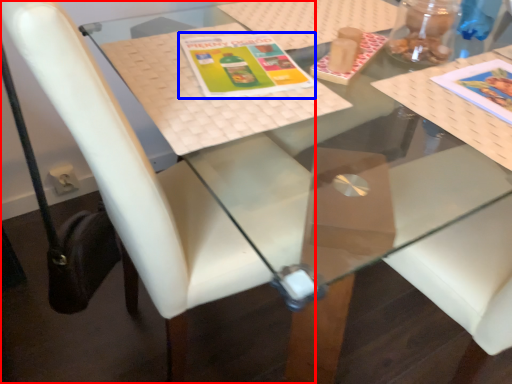
Question: Which object appears closest to the camera in this image, chair (highlighted by a red box) or book cover (highlighted by a blue box)?

Choices:
 (A) chair
 (B) book cover

Answer: (A)